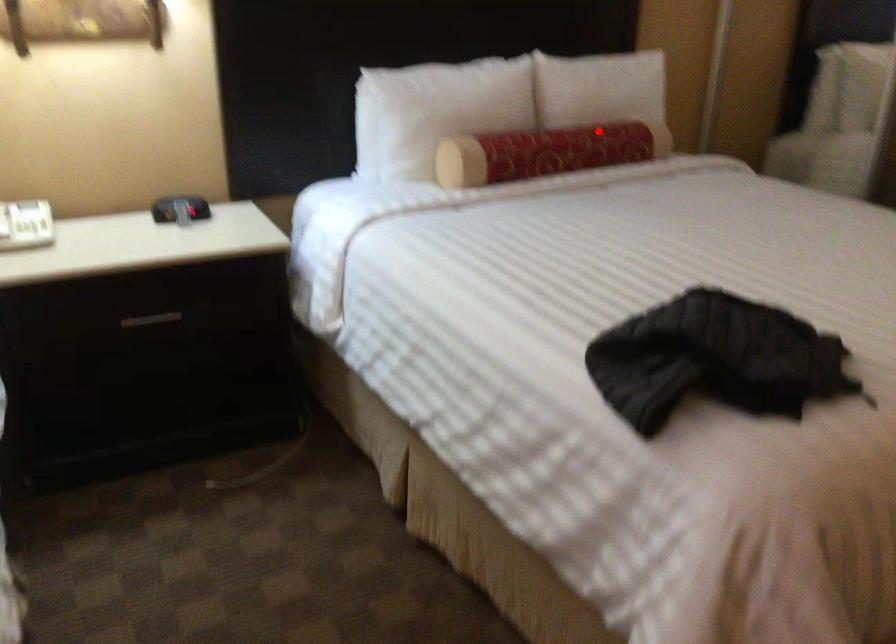
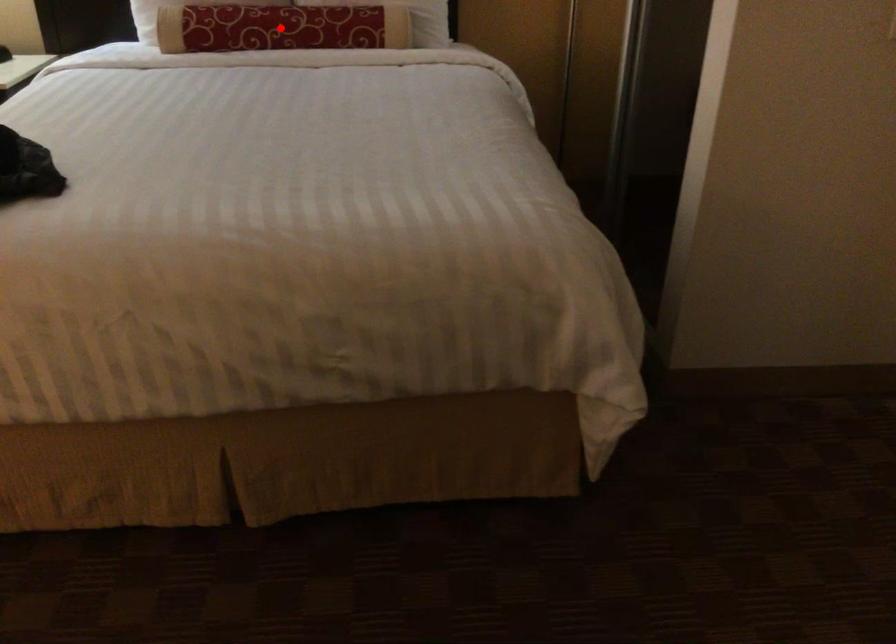
I am providing you with two images of the same scene from different viewpoints. A red point is marked on the first image and another point is marked on the second image. Is the marked point in image1 the same physical position as the marked point in image2?

No